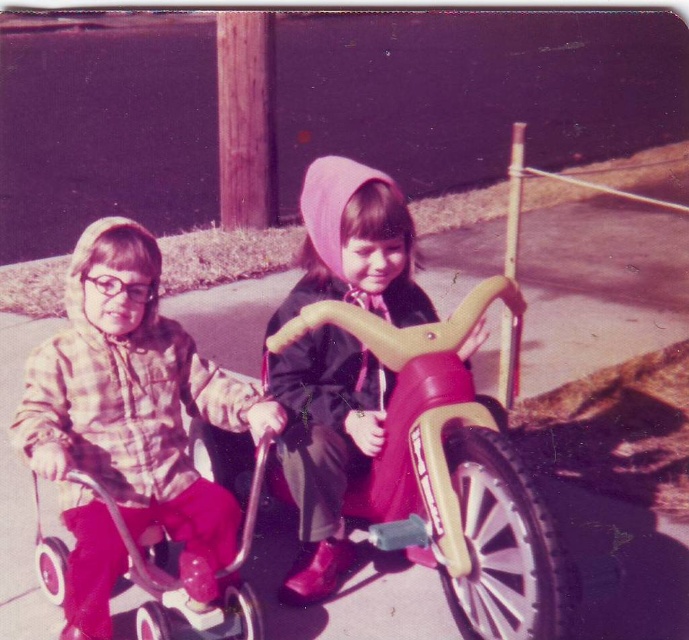
You are a photographer setting up a shot. You need to ensure that the plaid fabric shirt at left and the matte yellow tricycle at center are both in frame. Given that the camera has a limited field of view, which object should you prioritize framing first to ensure both are visible?

The plaid fabric shirt at left is wider than the matte yellow tricycle at center, so prioritize framing the plaid fabric shirt at left first to ensure both fit within the camera field of view.

You are standing in the scene and see a point marked at coordinates point (63, 595). If you want to reach this point quickly, which direction should you move in relation to your current position?

The point (63, 595) is 2.32 meters away from the viewer, so you should move forward towards it to reach it quickly.

You are a photographer trying to capture both the plaid fabric shirt at left and the matte yellow tricycle at center in a single shot. Based on their sizes, which object should you focus on first to ensure both are in frame?

Since the plaid fabric shirt at left is larger than the matte yellow tricycle at center, you should focus on the plaid fabric shirt at left first to ensure both fit within the frame.